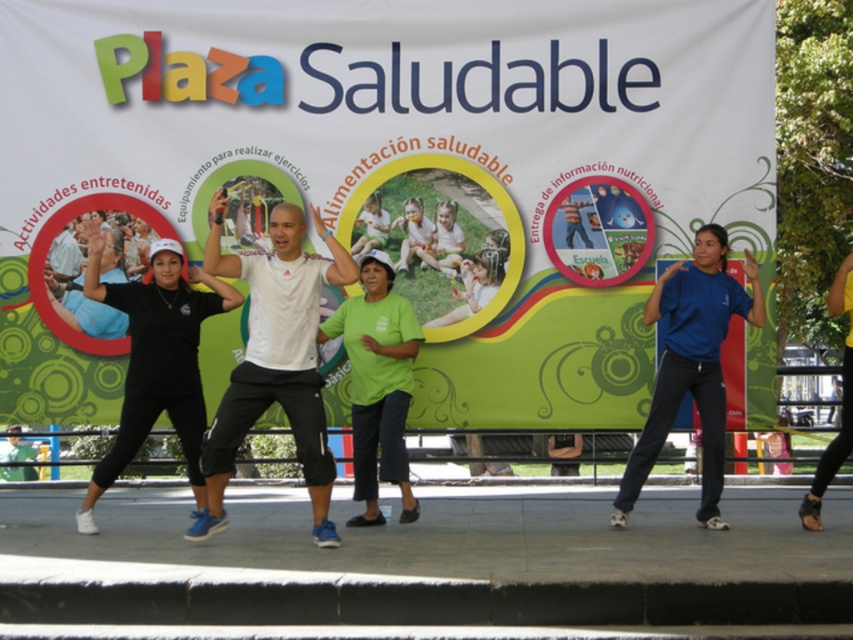
You are standing in the plaza and want to read the text on the white paper banner at upper center. If you have a smartphone with a zoom capability that can magnify objects up to 10 meters away, will you be able to read the text clearly?

The white paper banner at upper center is 8.08 meters away from the viewer. Since the smartphone can zoom up to 10 meters, it should be sufficient to read the text clearly.

You are a photographer standing at the edge of the plaza. You want to take a photo of the black matte shirt at center. Where should you aim your camera to capture it?

You should aim your camera at point 0.564 on the horizontal axis and point 0.185 on the vertical axis to capture the black matte shirt at center.

You are a photographer standing at the edge of the plaza. You want to take a photo that includes both the black matte shirt at center and the blue matte shirt at center. The camera you are using has a maximum focus range of 3 meters. Can you capture both subjects in focus without moving your position?

The black matte shirt at center and blue matte shirt at center are 3.62 meters apart from each other. Since the camera can only focus within 3 meters, the distance between them exceeds the focus range. Therefore, you cannot capture both subjects in focus without moving your position.